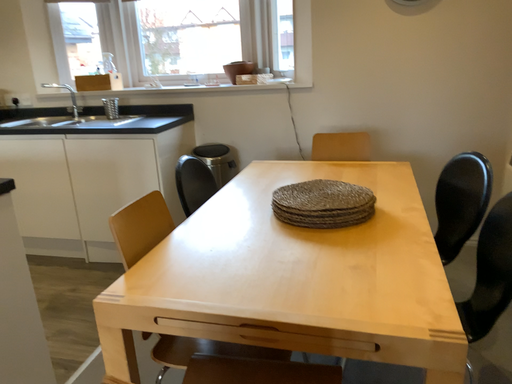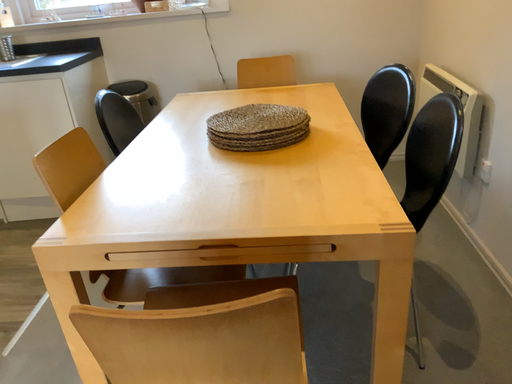
Question: Which way did the camera rotate in the video?

Choices:
 (A) rotated downward
 (B) rotated upward

Answer: (A)